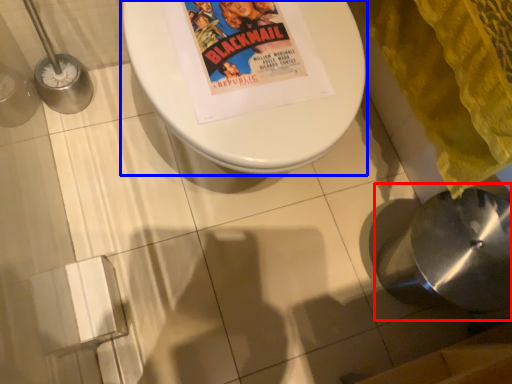
Question: Which of the following is the farthest to the observer, sink (highlighted by a red box) or toilet (highlighted by a blue box)?

Choices:
 (A) sink
 (B) toilet

Answer: (A)